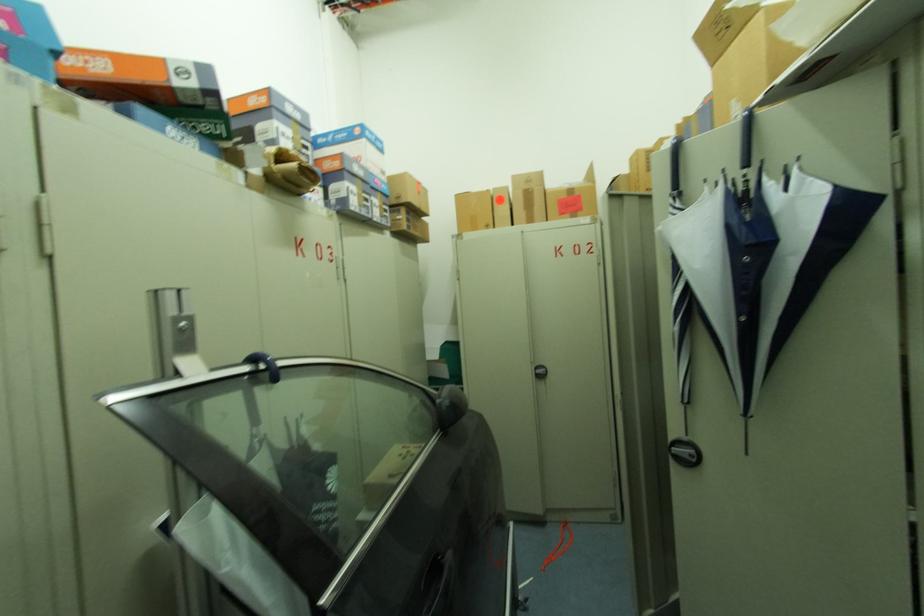
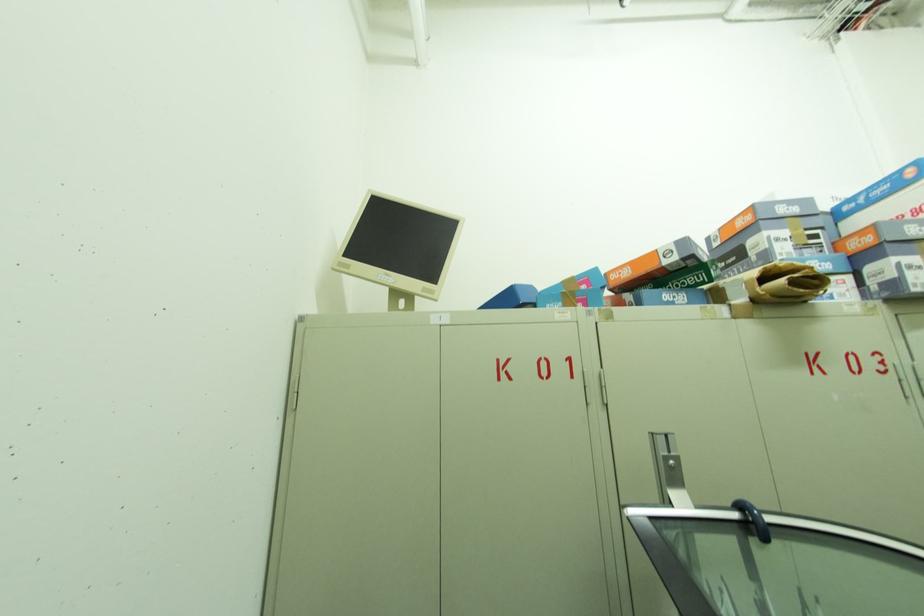
Question: Based on the continuous images, in which direction is the camera rotating? Reply with the corresponding letter.

Choices:
 (A) Left
 (B) Right
 (C) Up
 (D) Down

Answer: (A)